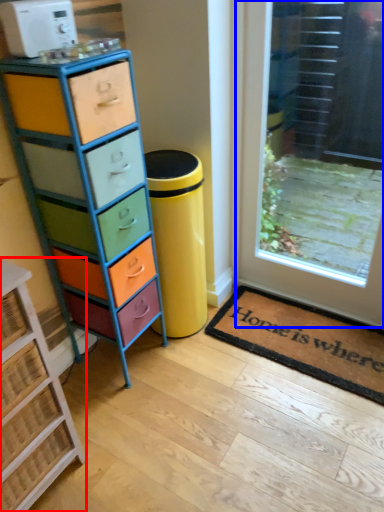
Question: Which point is closer to the camera, chest of drawers (highlighted by a red box) or door (highlighted by a blue box)?

Choices:
 (A) chest of drawers
 (B) door

Answer: (A)